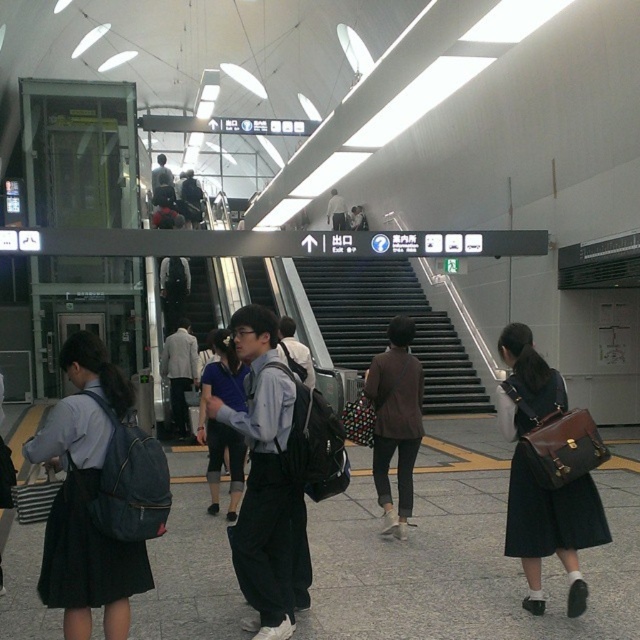
Is denim backpack at left below matte blue backpack at center?

Incorrect, denim backpack at left is not positioned below matte blue backpack at center.

Is denim backpack at left above matte blue backpack at center?

Yes.

Which is behind, point (35, 436) or point (227, 336)?

The point (227, 336) is more distant.

Where is `denim backpack at left`? denim backpack at left is located at coordinates (90, 577).

Is denim backpack at left wider than black metal stairs at center?

Yes.

Is the position of denim backpack at left more distant than that of black metal stairs at center?

No, denim backpack at left is in front of black metal stairs at center.

What do you see at coordinates (90, 577) in the screenshot?
I see `denim backpack at left` at bounding box center [90, 577].

This screenshot has width=640, height=640. I want to click on denim backpack at left, so click(90, 577).

Does matte brown leather bag at lower right have a smaller size compared to matte blue backpack at center?

Correct, matte brown leather bag at lower right occupies less space than matte blue backpack at center.

This screenshot has width=640, height=640. What do you see at coordinates (547, 470) in the screenshot?
I see `matte brown leather bag at lower right` at bounding box center [547, 470].

Is point (504, 360) closer to viewer compared to point (228, 403)?

Yes, point (504, 360) is closer to viewer.

Find the location of a particular element. matte brown leather bag at lower right is located at coordinates [547, 470].